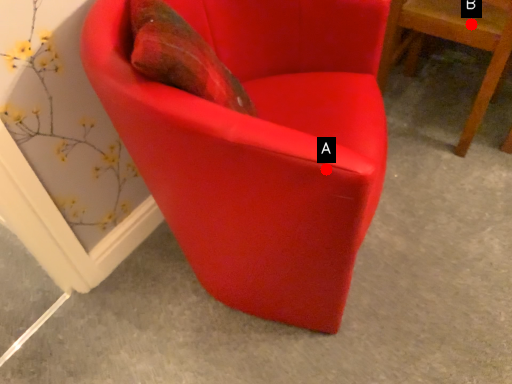
Question: Two points are circled on the image, labeled by A and B beside each circle. Which point is farther from the camera taking this photo?

Choices:
 (A) A is further
 (B) B is further

Answer: (B)